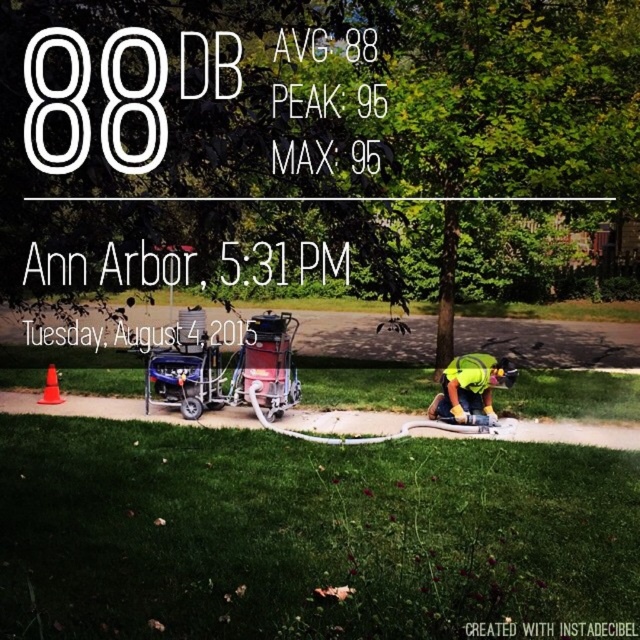
Question: Is metallic blue cart at center positioned before yellow reflective safety vest at lower right?

Choices:
 (A) yes
 (B) no

Answer: (B)

Question: Which point appears farthest from the camera in this image?

Choices:
 (A) (184, 332)
 (B) (474, 358)
 (C) (486, 401)
 (D) (58, 401)

Answer: (D)

Question: Does yellow fabric safety vest at lower right come in front of orange plastic cone at lower left?

Choices:
 (A) yes
 (B) no

Answer: (A)

Question: Is yellow fabric safety vest at lower right positioned in front of orange plastic cone at lower left?

Choices:
 (A) no
 (B) yes

Answer: (B)

Question: Which point is farther to the camera?

Choices:
 (A) orange plastic cone at lower left
 (B) yellow fabric safety vest at lower right
 (C) yellow reflective safety vest at lower right
 (D) metallic blue cart at center

Answer: (A)

Question: Which object is closer to the camera taking this photo?

Choices:
 (A) yellow reflective safety vest at lower right
 (B) orange plastic cone at lower left

Answer: (A)